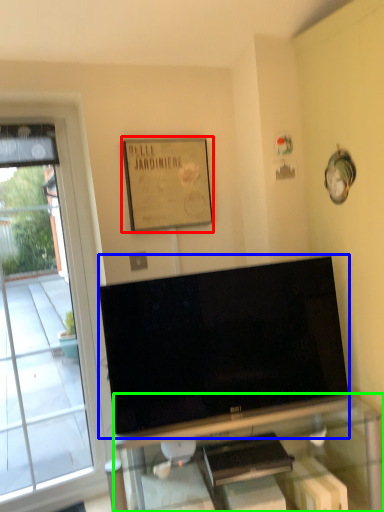
Question: Which object is positioned closest to picture frame (highlighted by a red box)? Select from television (highlighted by a blue box) and furniture (highlighted by a green box).

Choices:
 (A) television
 (B) furniture

Answer: (A)